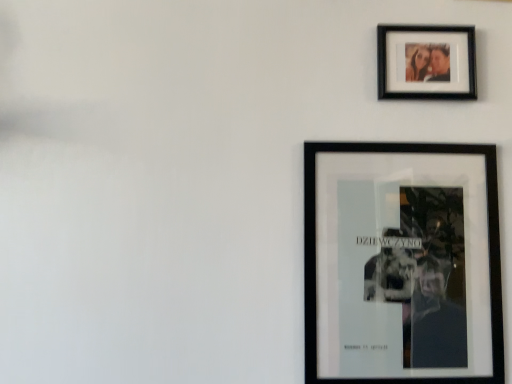
Question: From the image's perspective, is black matte photo frame at upper right, which is the 2th picture frame from bottom to top, below black matte poster at lower right, which ranks as the first picture frame in bottom-to-top order?

Choices:
 (A) no
 (B) yes

Answer: (A)

Question: Is black matte photo frame at upper right, which is the 2th picture frame from bottom to top, smaller than black matte poster at lower right, positioned as the 2th picture frame in top-to-bottom order?

Choices:
 (A) no
 (B) yes

Answer: (B)

Question: Is black matte photo frame at upper right, the 1th picture frame viewed from the top, oriented away from black matte poster at lower right, positioned as the 2th picture frame in top-to-bottom order?

Choices:
 (A) no
 (B) yes

Answer: (A)

Question: From a real-world perspective, is black matte photo frame at upper right, which is the 2th picture frame from bottom to top, physically below black matte poster at lower right, which ranks as the first picture frame in bottom-to-top order?

Choices:
 (A) no
 (B) yes

Answer: (A)

Question: Is black matte photo frame at upper right, which is the 2th picture frame from bottom to top, oriented towards black matte poster at lower right, positioned as the 2th picture frame in top-to-bottom order?

Choices:
 (A) no
 (B) yes

Answer: (A)

Question: Does black matte photo frame at upper right, the 1th picture frame viewed from the top, have a lesser width compared to black matte poster at lower right, which ranks as the first picture frame in bottom-to-top order?

Choices:
 (A) yes
 (B) no

Answer: (A)

Question: Is the position of black matte poster at lower right, which ranks as the first picture frame in bottom-to-top order, more distant than that of black matte photo frame at upper right, which is the 2th picture frame from bottom to top?

Choices:
 (A) yes
 (B) no

Answer: (B)

Question: From the image's perspective, would you say black matte poster at lower right, positioned as the 2th picture frame in top-to-bottom order, is positioned over black matte photo frame at upper right, which is the 2th picture frame from bottom to top?

Choices:
 (A) no
 (B) yes

Answer: (A)

Question: Does black matte poster at lower right, which ranks as the first picture frame in bottom-to-top order, have a lesser height compared to black matte photo frame at upper right, the 1th picture frame viewed from the top?

Choices:
 (A) yes
 (B) no

Answer: (B)

Question: From a real-world perspective, is black matte poster at lower right, which ranks as the first picture frame in bottom-to-top order, physically below black matte photo frame at upper right, which is the 2th picture frame from bottom to top?

Choices:
 (A) no
 (B) yes

Answer: (B)

Question: Is black matte photo frame at upper right, the 1th picture frame viewed from the top, located within black matte poster at lower right, which ranks as the first picture frame in bottom-to-top order?

Choices:
 (A) yes
 (B) no

Answer: (B)

Question: Is black matte poster at lower right, which ranks as the first picture frame in bottom-to-top order, not near black matte photo frame at upper right, which is the 2th picture frame from bottom to top?

Choices:
 (A) no
 (B) yes

Answer: (A)

Question: In terms of width, does black matte photo frame at upper right, which is the 2th picture frame from bottom to top, look wider or thinner when compared to black matte poster at lower right, positioned as the 2th picture frame in top-to-bottom order?

Choices:
 (A) wide
 (B) thin

Answer: (B)